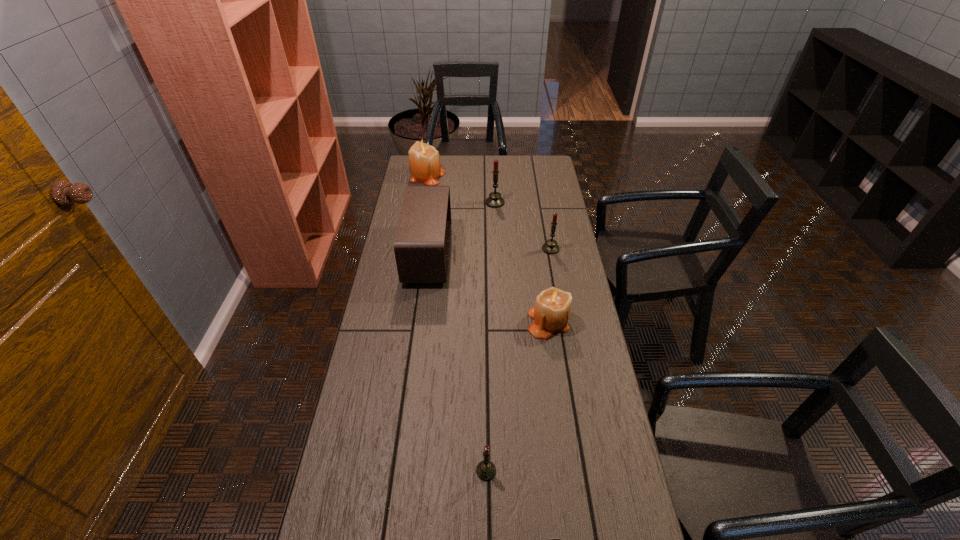
Locate an element on the screen. the fourth nearest candle is located at coordinates (495, 200).

This screenshot has height=540, width=960. Identify the location of the sixth nearest object. (495, 200).

Identify the location of brown radio receiver. The image size is (960, 540). pos(422,241).

Find the location of a particular element. the leftmost candle is located at coordinates 424,161.

Where is `the left beige candle`? The height and width of the screenshot is (540, 960). the left beige candle is located at coordinates (424, 161).

This screenshot has height=540, width=960. Identify the location of the second farthest red candle. (550, 247).

Where is `the rightmost red candle`? the rightmost red candle is located at coordinates (550, 247).

At what (x,y) coordinates should I click in order to perform the action: click on the smaller beige candle. Please return your answer as a coordinate pair (x, y). This screenshot has height=540, width=960. Looking at the image, I should click on (551, 313).

In order to click on the third nearest object in this screenshot , I will do `click(551, 313)`.

Locate an element on the screen. The height and width of the screenshot is (540, 960). the second nearest object is located at coordinates (486, 470).